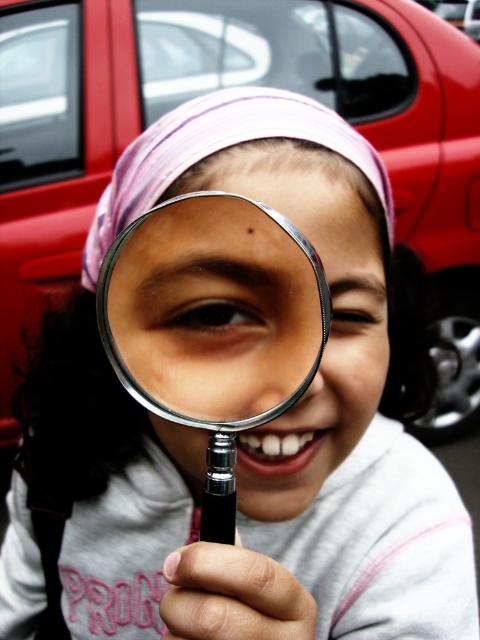
Question: Which of the following is the farthest from the observer?

Choices:
 (A) (56, 60)
 (B) (317, 364)
 (C) (135, 163)

Answer: (A)

Question: Does metallic silver magnifying glass at center appear on the left side of purple fabric headscarf at center?

Choices:
 (A) no
 (B) yes

Answer: (A)

Question: Is metallic red car at upper center below metallic silver magnifying glass at center?

Choices:
 (A) no
 (B) yes

Answer: (A)

Question: Is metallic red car at upper center smaller than purple fabric headscarf at center?

Choices:
 (A) yes
 (B) no

Answer: (B)

Question: Among these objects, which one is farthest from the camera?

Choices:
 (A) purple fabric headscarf at center
 (B) metallic silver magnifying glass at center

Answer: (A)

Question: Based on their relative distances, which object is nearer to the purple fabric headscarf at center?

Choices:
 (A) metallic red car at upper center
 (B) metallic silver magnifying glass at center

Answer: (B)